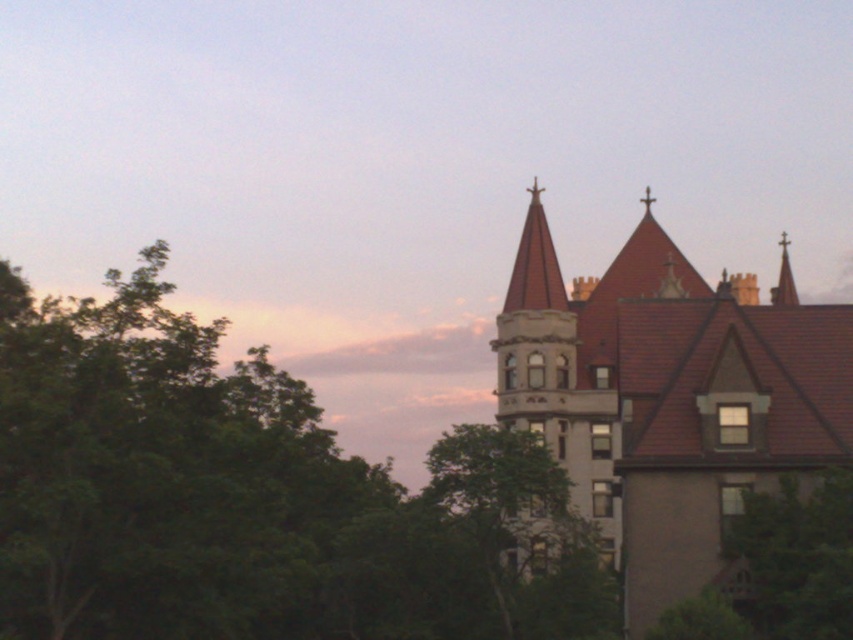
Is point (564, 404) closer to camera compared to point (821, 561)?

No, it is behind (821, 561).

Based on the photo, measure the distance from white stone tower at center to green leafy tree at lower right.

A distance of 41.70 meters exists between white stone tower at center and green leafy tree at lower right.

Locate an element on the screen. The image size is (853, 640). white stone tower at center is located at coordinates (556, 380).

Does green leafy tree at upper left appear on the right side of green leafy tree at lower right?

In fact, green leafy tree at upper left is to the left of green leafy tree at lower right.

Is point (456, 426) in front of point (750, 612)?

No, (456, 426) is further to viewer.

I want to click on green leafy tree at upper left, so click(x=251, y=497).

This screenshot has width=853, height=640. What are the coordinates of `green leafy tree at upper left` in the screenshot? It's located at (251, 497).

Is green leafy tree at upper left behind white stone tower at center?

No, green leafy tree at upper left is in front of white stone tower at center.

Image resolution: width=853 pixels, height=640 pixels. Find the location of `green leafy tree at upper left`. green leafy tree at upper left is located at coordinates (251, 497).

Where is `green leafy tree at upper left`? The width and height of the screenshot is (853, 640). green leafy tree at upper left is located at coordinates (251, 497).